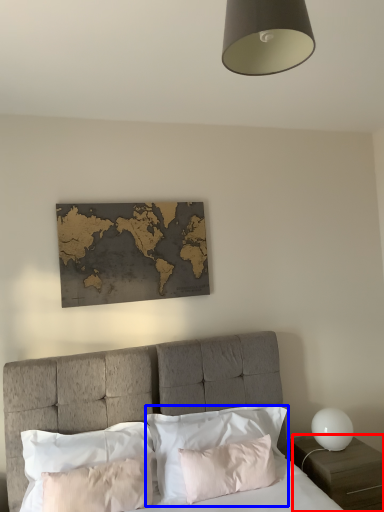
Question: Which object appears closest to the camera in this image, nightstand (highlighted by a red box) or pillow (highlighted by a blue box)?

Choices:
 (A) nightstand
 (B) pillow

Answer: (B)